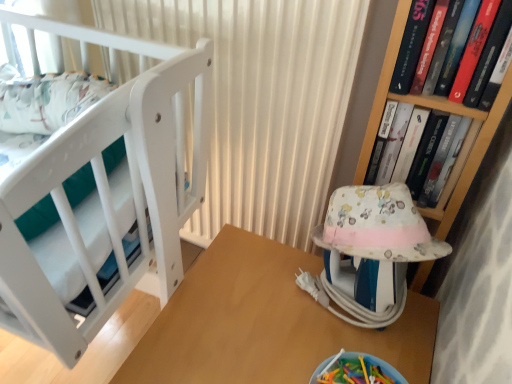
Image resolution: width=512 pixels, height=384 pixels. What do you see at coordinates (265, 323) in the screenshot?
I see `wooden table at center` at bounding box center [265, 323].

What is the approximate height of fluffy fabric baby carriage at right?

fluffy fabric baby carriage at right is 8.61 inches tall.

What do you see at coordinates (104, 194) in the screenshot? I see `white matte crib at left` at bounding box center [104, 194].

The height and width of the screenshot is (384, 512). Find the location of `hardcover book at upper right, the first book in the front-to-back sequence`. hardcover book at upper right, the first book in the front-to-back sequence is located at coordinates (481, 56).

The image size is (512, 384). What do you see at coordinates (262, 102) in the screenshot?
I see `white matte curtain at upper center` at bounding box center [262, 102].

Identify the location of white matte curtain at upper center. (262, 102).

The width and height of the screenshot is (512, 384). What are the coordinates of `hardcover book at upper right, the second book when ordered from front to back` in the screenshot? It's located at (456, 162).

You are a GUI agent. You are given a task and a screenshot of the screen. Output one action in this format:
    pyautogui.click(x=<x>, y=<y>)
    Task: Click on the table on the right of white matte crib at left
    The image size is (512, 384).
    Given the screenshot: What is the action you would take?
    click(265, 323)

Is wooden table at center surrounding white matte crib at left?

No.

Considering the positions of objects wooden table at center and white matte crib at left in the image provided, who is more to the right, wooden table at center or white matte crib at left?

wooden table at center.

From the picture: From the image's perspective, which one is positioned higher, wooden table at center or white matte crib at left?

white matte crib at left.

Is white matte curtain at upper center spatially inside hardcover book at upper right, the second book when ordered from front to back, or outside of it?

white matte curtain at upper center is located beyond the bounds of hardcover book at upper right, the second book when ordered from front to back.

Who is taller, white matte curtain at upper center or hardcover book at upper right, the first book from the back?

With more height is white matte curtain at upper center.

Which object is closer to the camera taking this photo, white matte curtain at upper center or hardcover book at upper right, the first book from the back?

white matte curtain at upper center.

The height and width of the screenshot is (384, 512). What are the coordinates of `book that is the 1st one above the white matte curtain at upper center (from a real-world perspective)` in the screenshot? It's located at (456, 162).

At what (x,y) coordinates should I click in order to perform the action: click on book that appears above the hardcover book at upper right, the first book from the back (from the image's perspective). Please return your answer as a coordinate pair (x, y). The width and height of the screenshot is (512, 384). Looking at the image, I should click on (x=481, y=56).

Can you tell me how much hardcover book at upper right, the second book when ordered from front to back, and hardcover book at upper right, the first book in the front-to-back sequence, differ in facing direction?

The facing directions of hardcover book at upper right, the second book when ordered from front to back, and hardcover book at upper right, the first book in the front-to-back sequence, are 0.00324 degrees apart.

Considering the relative sizes of hardcover book at upper right, the first book from the back, and hardcover book at upper right, positioned as the second book in back-to-front order, in the image provided, is hardcover book at upper right, the first book from the back, bigger than hardcover book at upper right, positioned as the second book in back-to-front order,?

Yes.

In the scene shown: Considering the positions of objects white matte curtain at upper center and hardcover book at upper right, the first book in the front-to-back sequence, in the image provided, who is more to the right, white matte curtain at upper center or hardcover book at upper right, the first book in the front-to-back sequence,?

hardcover book at upper right, the first book in the front-to-back sequence.

Between white matte curtain at upper center and hardcover book at upper right, the first book in the front-to-back sequence, which one is positioned in front?

hardcover book at upper right, the first book in the front-to-back sequence, is more forward.

How many degrees apart are the facing directions of white matte curtain at upper center and hardcover book at upper right, the first book in the front-to-back sequence?

There is a 3.94-degree angle between the facing directions of white matte curtain at upper center and hardcover book at upper right, the first book in the front-to-back sequence.

Identify the location of the 2nd book located above the white matte curtain at upper center (from a real-world perspective). (481, 56).

From a real-world perspective, is white matte curtain at upper center under fluffy fabric baby carriage at right?

No, from a real-world perspective, white matte curtain at upper center is not beneath fluffy fabric baby carriage at right.

Does white matte curtain at upper center contain fluffy fabric baby carriage at right?

Actually, fluffy fabric baby carriage at right is outside white matte curtain at upper center.

From the image's perspective, is white matte curtain at upper center located above or below fluffy fabric baby carriage at right?

Based on their image positions, white matte curtain at upper center is located above fluffy fabric baby carriage at right.

Can you tell me how much wooden table at center and white matte curtain at upper center differ in facing direction?

There is a 89.4-degree angle between the facing directions of wooden table at center and white matte curtain at upper center.

Is wooden table at center inside the boundaries of white matte curtain at upper center, or outside?

wooden table at center is outside white matte curtain at upper center.

Is wooden table at center at the right side of white matte curtain at upper center?

Correct, you'll find wooden table at center to the right of white matte curtain at upper center.

Is wooden table at center far from white matte curtain at upper center?

That's not correct — wooden table at center is a little close to white matte curtain at upper center.

Would you say fluffy fabric baby carriage at right is part of hardcover book at upper right, the second book when ordered from front to back,'s contents?

That's incorrect, fluffy fabric baby carriage at right is not inside hardcover book at upper right, the second book when ordered from front to back.

Who is bigger, hardcover book at upper right, the first book from the back, or fluffy fabric baby carriage at right?

Bigger between the two is fluffy fabric baby carriage at right.

Could you tell me if hardcover book at upper right, the first book from the back, is facing fluffy fabric baby carriage at right?

Yes, hardcover book at upper right, the first book from the back, is oriented towards fluffy fabric baby carriage at right.

This screenshot has height=384, width=512. Find the location of `furniture in front of the wooden table at center`. furniture in front of the wooden table at center is located at coordinates (104, 194).

What are the coordinates of `the 2nd book counting from the right of the white matte curtain at upper center` in the screenshot? It's located at pyautogui.click(x=456, y=162).

Estimate the real-world distances between objects in this image. Which object is further from white matte curtain at upper center, wooden table at center or white matte crib at left?

wooden table at center.

Based on their spatial positions, is white matte crib at left or fluffy fabric baby carriage at right closer to hardcover book at upper right, the first book from the back?

fluffy fabric baby carriage at right.

Considering their positions, is fluffy fabric baby carriage at right positioned closer to hardcover book at upper right, positioned as the second book in back-to-front order, than wooden table at center?

The object closer to hardcover book at upper right, positioned as the second book in back-to-front order, is fluffy fabric baby carriage at right.

Estimate the real-world distances between objects in this image. Which object is closer to white matte crib at left, hardcover book at upper right, the first book in the front-to-back sequence, or hardcover book at upper right, the second book when ordered from front to back?

Among the two, hardcover book at upper right, the first book in the front-to-back sequence, is located nearer to white matte crib at left.

Based on their spatial positions, is white matte curtain at upper center or wooden table at center closer to hardcover book at upper right, the first book from the back?

Among the two, white matte curtain at upper center is located nearer to hardcover book at upper right, the first book from the back.

Estimate the real-world distances between objects in this image. Which object is further from hardcover book at upper right, the second book when ordered from front to back, white matte curtain at upper center or hardcover book at upper right, the first book in the front-to-back sequence?

The object further to hardcover book at upper right, the second book when ordered from front to back, is white matte curtain at upper center.

When comparing their distances from hardcover book at upper right, the first book from the back, does fluffy fabric baby carriage at right or wooden table at center seem further?

Based on the image, wooden table at center appears to be further to hardcover book at upper right, the first book from the back.

When comparing their distances from hardcover book at upper right, the first book in the front-to-back sequence, does white matte crib at left or white matte curtain at upper center seem closer?

white matte curtain at upper center.

Locate an element on the screen. book that lies between white matte curtain at upper center and wooden table at center from top to bottom is located at coordinates (456, 162).

At what (x,y) coordinates should I click in order to perform the action: click on baby carriage situated between white matte crib at left and hardcover book at upper right, the second book when ordered from front to back, from left to right. Please return your answer as a coordinate pair (x, y). Image resolution: width=512 pixels, height=384 pixels. Looking at the image, I should click on (370, 252).

Find the location of a particular element. The image size is (512, 384). curtain between hardcover book at upper right, positioned as the second book in back-to-front order, and wooden table at center vertically is located at coordinates (262, 102).

Find the location of a particular element. Image resolution: width=512 pixels, height=384 pixels. baby carriage between white matte curtain at upper center and hardcover book at upper right, the second book when ordered from front to back is located at coordinates (370, 252).